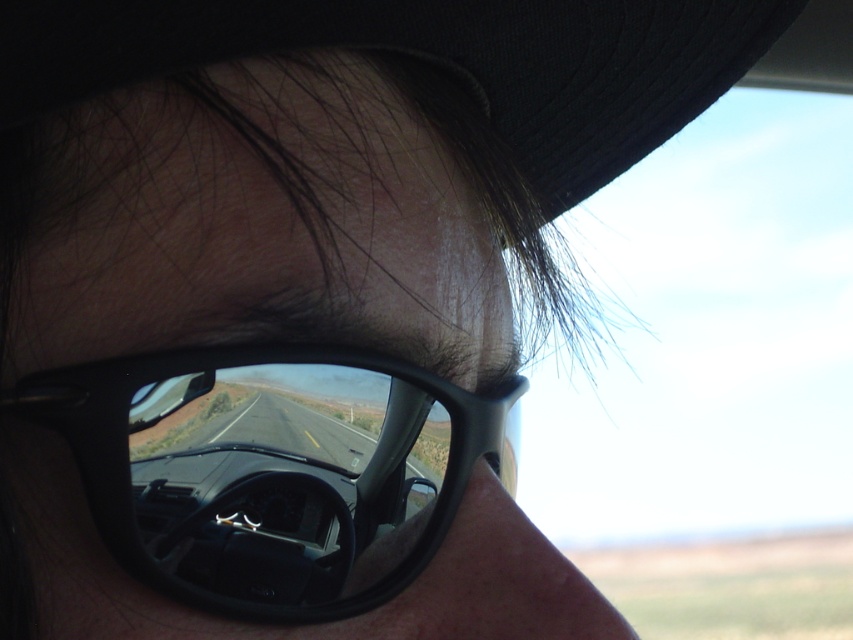
You are a passenger in the car and you see two points in the reflection of the sunglasses. The points are labeled as point [318,356] and point [630,3]. Which point is closer to the driver?

Point [318,356] is in front of point [630,3], so it is closer to the driver.